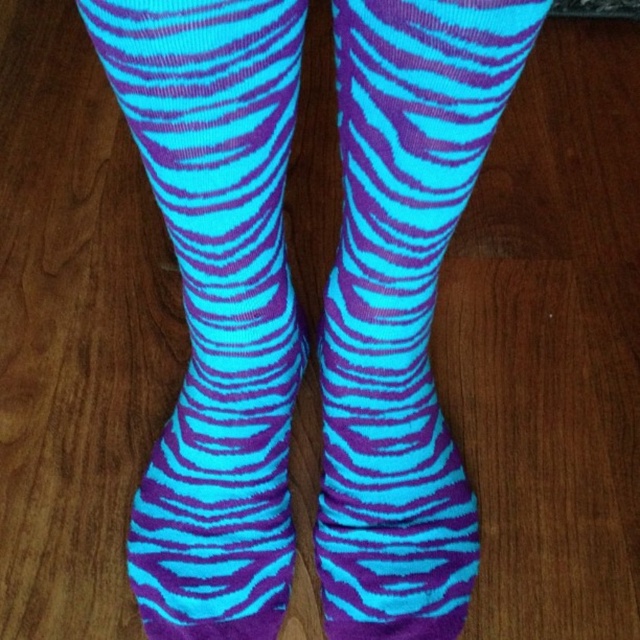
Does neon blue zebra-patterned sock at center have a larger size compared to turquoise matte socks at center?

Yes, neon blue zebra-patterned sock at center is bigger than turquoise matte socks at center.

Is point (288, 582) less distant than point (481, 109)?

No, (288, 582) is behind (481, 109).

In order to click on neon blue zebra-patterned sock at center in this screenshot , I will do 216,304.